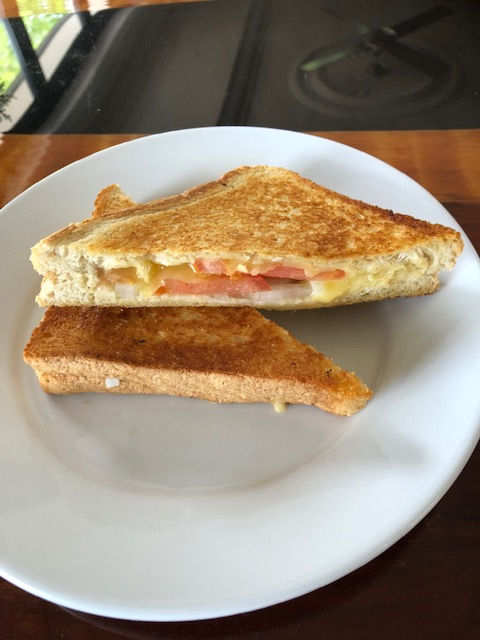
In order to click on plant in this screenshot , I will do `click(2, 97)`.